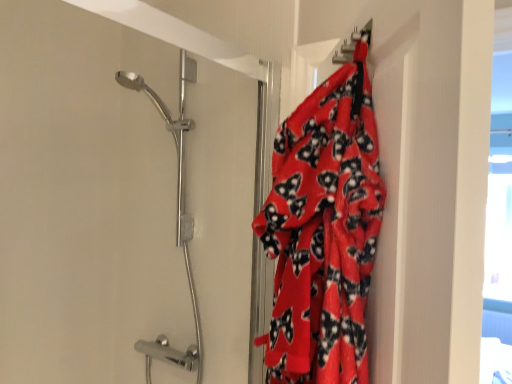
Question: Based on their sizes in the image, would you say fluffy red blanket at right is bigger or smaller than polished chrome shower head at upper left?

Choices:
 (A) big
 (B) small

Answer: (B)

Question: Is fluffy red blanket at right wider or thinner than polished chrome shower head at upper left?

Choices:
 (A) thin
 (B) wide

Answer: (A)

Question: Considering the positions of fluffy red blanket at right and polished chrome shower head at upper left in the image, is fluffy red blanket at right taller or shorter than polished chrome shower head at upper left?

Choices:
 (A) short
 (B) tall

Answer: (A)

Question: Considering their positions, is polished chrome shower head at upper left located in front of or behind fluffy red blanket at right?

Choices:
 (A) behind
 (B) front

Answer: (A)

Question: From the image's perspective, is polished chrome shower head at upper left above or below fluffy red blanket at right?

Choices:
 (A) above
 (B) below

Answer: (B)

Question: Considering the relative positions of polished chrome shower head at upper left and fluffy red blanket at right in the image provided, is polished chrome shower head at upper left to the left or to the right of fluffy red blanket at right?

Choices:
 (A) left
 (B) right

Answer: (A)

Question: Does point (200, 352) appear closer or farther from the camera than point (369, 218)?

Choices:
 (A) farther
 (B) closer

Answer: (A)